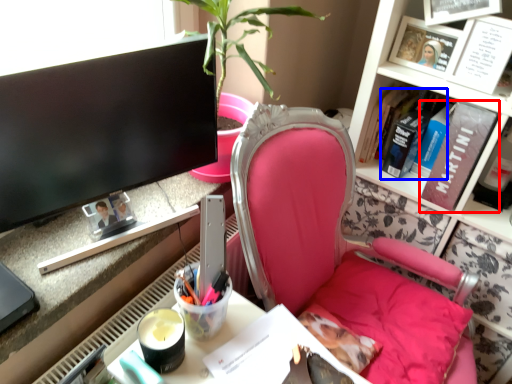
Question: Which point is further to the camera, book (highlighted by a red box) or book (highlighted by a blue box)?

Choices:
 (A) book
 (B) book

Answer: (B)